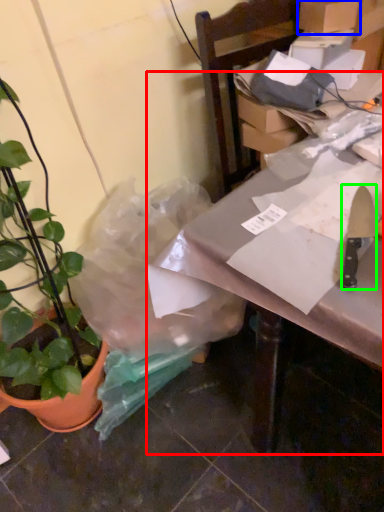
Question: Based on their relative distances, which object is farther from table (highlighted by a red box)? Choose from cardboard box (highlighted by a blue box) and kitchen knife (highlighted by a green box).

Choices:
 (A) cardboard box
 (B) kitchen knife

Answer: (A)